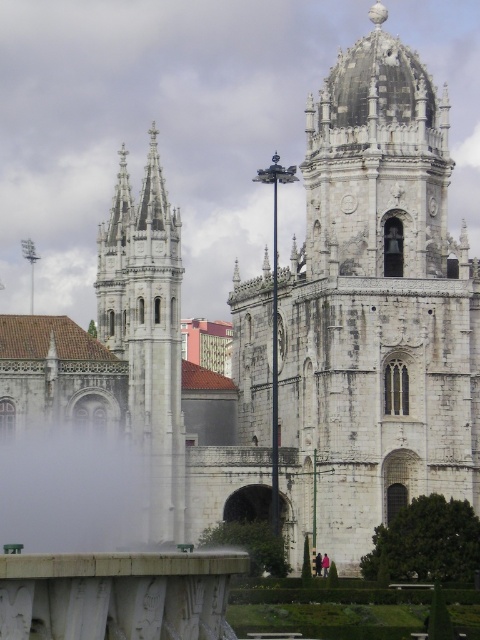
Question: Which point appears farthest from the camera in this image?

Choices:
 (A) (180, 394)
 (B) (34, 445)

Answer: (A)

Question: Is white stone tower at left to the left of white fog at lower center from the viewer's perspective?

Choices:
 (A) yes
 (B) no

Answer: (B)

Question: Can you confirm if white stone tower at left is thinner than white fog at lower center?

Choices:
 (A) no
 (B) yes

Answer: (A)

Question: Which point is closer to the camera taking this photo?

Choices:
 (A) (97, 497)
 (B) (132, 225)

Answer: (A)

Question: Is white stone tower at left wider than white fog at lower center?

Choices:
 (A) yes
 (B) no

Answer: (A)